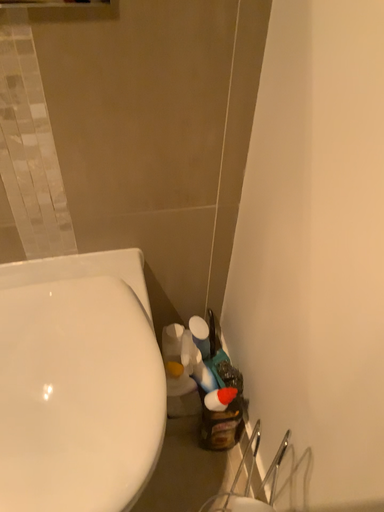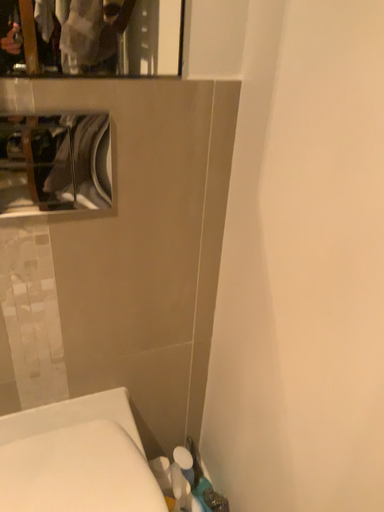
Question: How did the camera likely rotate when shooting the video?

Choices:
 (A) rotated left
 (B) rotated right

Answer: (B)